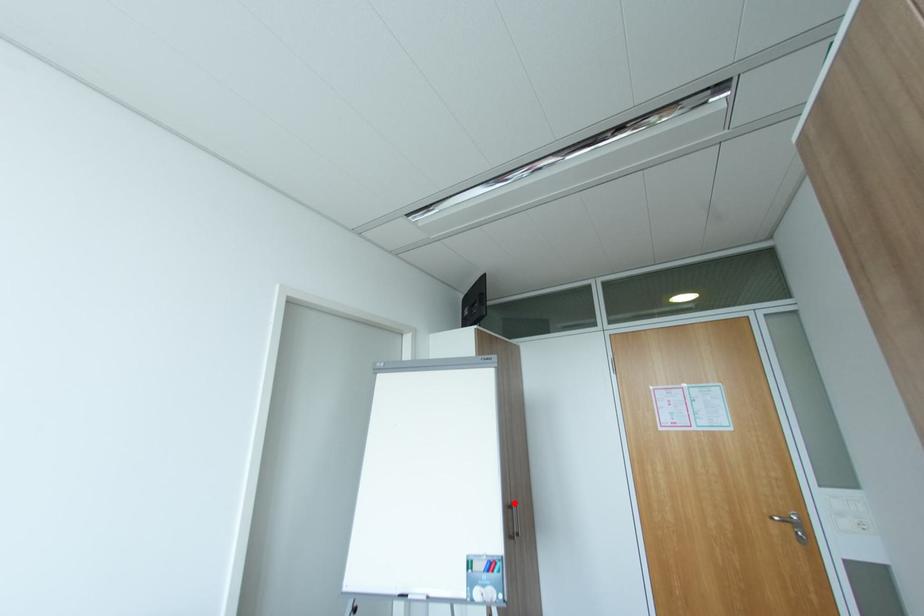
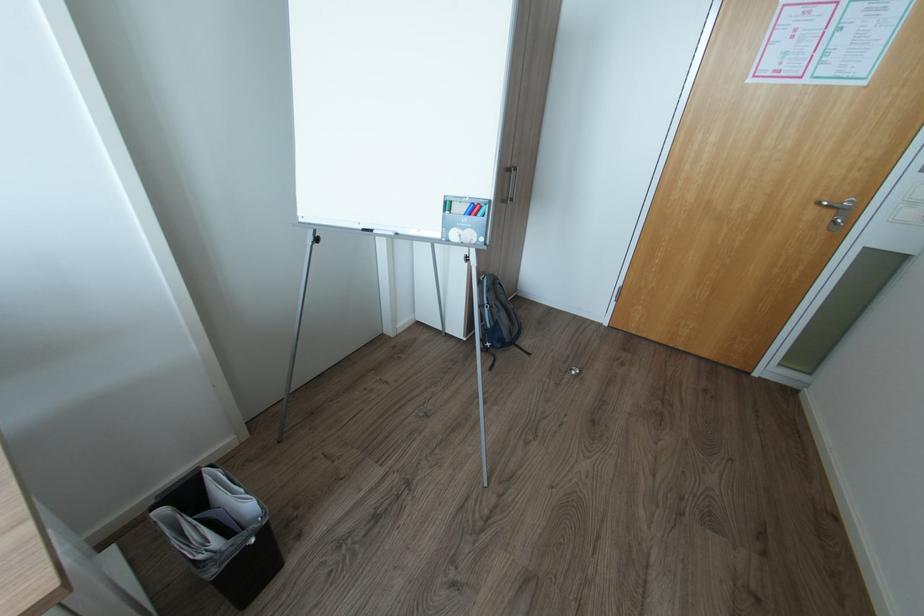
Question: A red point is marked in image1. In image2, is the corresponding 3D point closer to the camera or farther? Reply with the corresponding letter.

Choices:
 (A) The corresponding 3D point is closer.
 (B) The corresponding 3D point is farther.

Answer: (A)